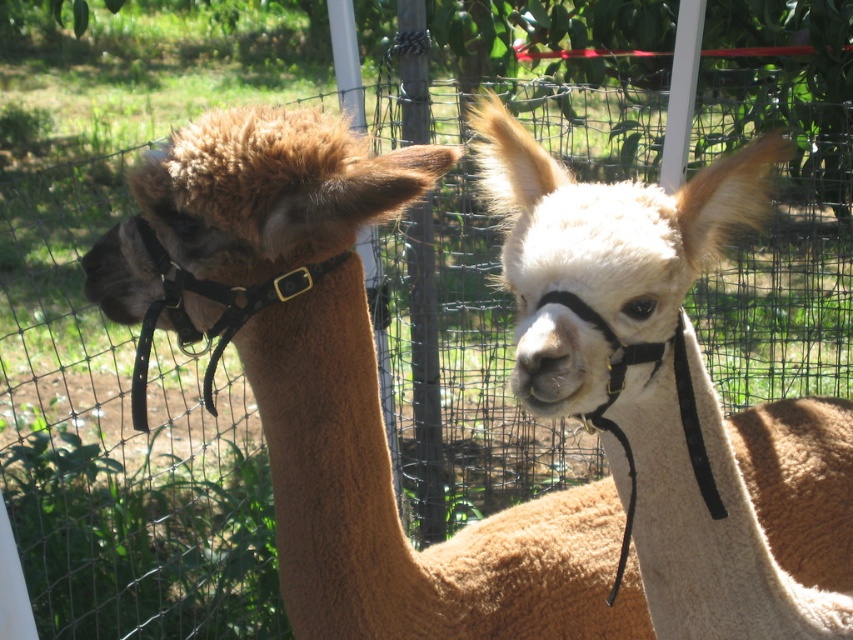
You are a photographer aiming to capture a clear photo of the white woolen alpaca at center and the white woolen nose at center. Which one should you focus on first to ensure both are in focus?

The white woolen alpaca at center is further to the viewer than the white woolen nose at center, so you should focus on the white woolen alpaca at center first to ensure both are in focus.

You are a farmer checking the fence between the white woolen alpaca at center and the white woolen nose at center. Can you determine if the alpaca can fit through the fence gaps if it tries to squeeze through?

The white woolen alpaca at center might be wider than white woolen nose at center, so it is possible that the alpaca cannot fit through the fence gaps if it tries to squeeze through.